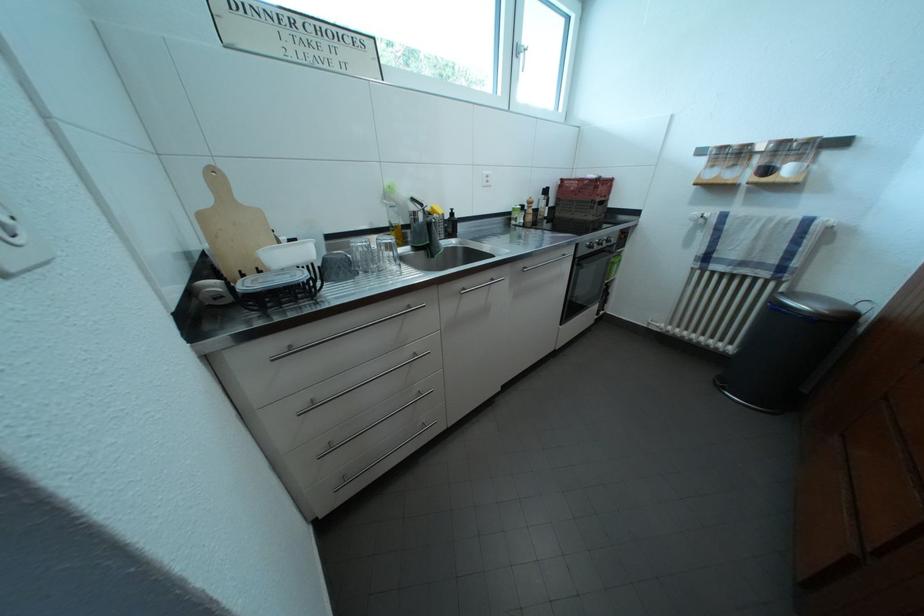
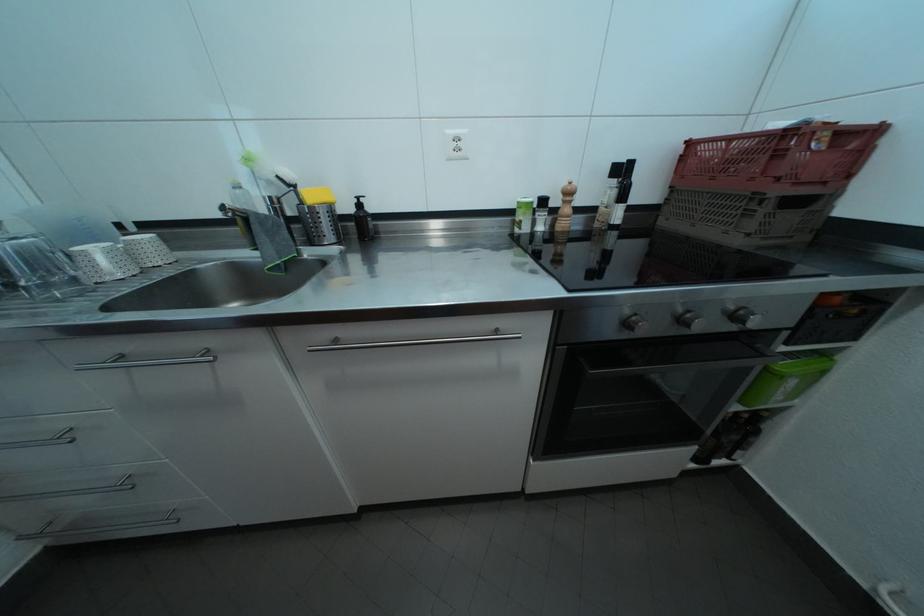
Where in the second image is the point corresponding to (533,274) from the first image?

(346, 347)